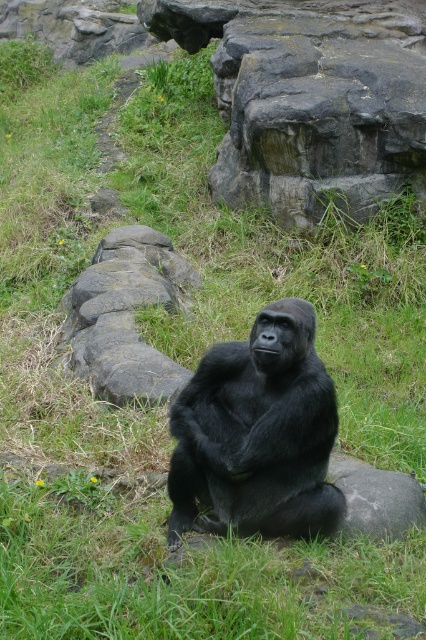
Between rough textured rock at upper center and gray rough stone at center, which one has more height?

rough textured rock at upper center

Who is more forward, (290, 52) or (127, 320)?

Positioned in front is point (127, 320).

Where is `rough textured rock at upper center`? rough textured rock at upper center is located at coordinates (308, 99).

In the scene shown: Who is lower down, rough textured rock at upper center or black fur gorilla at center?

black fur gorilla at center

Can you confirm if rough textured rock at upper center is positioned above black fur gorilla at center?

Yes, rough textured rock at upper center is above black fur gorilla at center.

Locate an element on the screen. This screenshot has width=426, height=640. rough textured rock at upper center is located at coordinates (308, 99).

Can you confirm if black fur gorilla at center is positioned above gray rough stone at center?

Actually, black fur gorilla at center is below gray rough stone at center.

Does point (258, 464) come behind point (111, 284)?

That is False.

Is point (281, 440) farther from camera compared to point (141, 388)?

No.

Where is `black fur gorilla at center`? Image resolution: width=426 pixels, height=640 pixels. black fur gorilla at center is located at coordinates (258, 433).